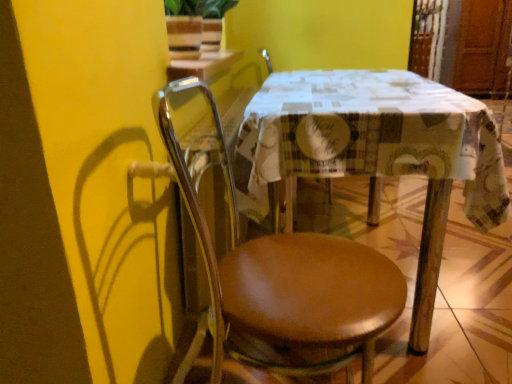
In the scene shown: What is the approximate height of brown leather chair at center?

It is 33.41 inches.

The image size is (512, 384). What do you see at coordinates (283, 277) in the screenshot?
I see `brown leather chair at center` at bounding box center [283, 277].

Where is `brown leather chair at center`? The image size is (512, 384). brown leather chair at center is located at coordinates (283, 277).

At what (x,y) coordinates should I click in order to perform the action: click on printed fabric table at center. Please return your answer as a coordinate pair (x, y). The height and width of the screenshot is (384, 512). Looking at the image, I should click on (376, 151).

Measure the distance between point (x=497, y=134) and camera.

The distance of point (x=497, y=134) from camera is 3.42 feet.

In order to face printed fabric table at center, should I rotate leftwards or rightwards?

It's best to rotate right around 11.702 degrees.

The width and height of the screenshot is (512, 384). Describe the element at coordinates (376, 151) in the screenshot. I see `printed fabric table at center` at that location.

What are the coordinates of `brown leather chair at center` in the screenshot? It's located at [x=283, y=277].

Is brown leather chair at center to the right of printed fabric table at center from the viewer's perspective?

No, brown leather chair at center is not to the right of printed fabric table at center.

Relative to printed fabric table at center, is brown leather chair at center in front or behind?

Visually, brown leather chair at center is located in front of printed fabric table at center.

Does point (220, 270) come closer to viewer compared to point (429, 172)?

Yes, it is.

From the image's perspective, is brown leather chair at center below printed fabric table at center?

Indeed, from the image's perspective, brown leather chair at center is shown beneath printed fabric table at center.

From a real-world perspective, between brown leather chair at center and printed fabric table at center, who is vertically lower?

printed fabric table at center.

Which of these two, brown leather chair at center or printed fabric table at center, is thinner?

With smaller width is brown leather chair at center.

Can you confirm if brown leather chair at center is shorter than printed fabric table at center?

No.

Can you confirm if brown leather chair at center is bigger than printed fabric table at center?

Actually, brown leather chair at center might be smaller than printed fabric table at center.

Which is correct: brown leather chair at center is inside printed fabric table at center, or outside of it?

brown leather chair at center lies outside printed fabric table at center.

Is brown leather chair at center with printed fabric table at center?

No.

From the picture: Is brown leather chair at center turned away from printed fabric table at center?

No, brown leather chair at center is not facing away from printed fabric table at center.

How many degrees apart are the facing directions of brown leather chair at center and printed fabric table at center?

0.000523 degrees separate the facing orientations of brown leather chair at center and printed fabric table at center.

In order to click on table located behind the brown leather chair at center in this screenshot , I will do `click(376, 151)`.

Considering the positions of objects printed fabric table at center and brown leather chair at center in the image provided, who is more to the left, printed fabric table at center or brown leather chair at center?

From the viewer's perspective, brown leather chair at center appears more on the left side.

Considering the relative positions of printed fabric table at center and brown leather chair at center in the image provided, is printed fabric table at center behind brown leather chair at center?

Yes.

Is point (502, 219) less distant than point (279, 351)?

Yes, it is.

From the image's perspective, which one is positioned higher, printed fabric table at center or brown leather chair at center?

printed fabric table at center, from the image's perspective.

From a real-world perspective, is printed fabric table at center below brown leather chair at center?

Yes, from a real-world perspective, printed fabric table at center is below brown leather chair at center.

Can you confirm if printed fabric table at center is thinner than brown leather chair at center?

No.

Based on the photo, is printed fabric table at center shorter than brown leather chair at center?

Correct, printed fabric table at center is not as tall as brown leather chair at center.

Considering the sizes of objects printed fabric table at center and brown leather chair at center in the image provided, who is smaller, printed fabric table at center or brown leather chair at center?

brown leather chair at center is smaller.

Is brown leather chair at center located within printed fabric table at center?

No, brown leather chair at center is located outside of printed fabric table at center.

Is printed fabric table at center directly adjacent to brown leather chair at center?

They are not placed beside each other.

Is brown leather chair at center at the back of printed fabric table at center?

No, printed fabric table at center's orientation is not away from brown leather chair at center.

Locate an element on the screen. chair on the left of the printed fabric table at center is located at coordinates tap(283, 277).

Find the location of a particular element. Image resolution: width=512 pixels, height=384 pixels. chair located in front of the printed fabric table at center is located at coordinates (283, 277).

Identify the location of table behind the brown leather chair at center. (376, 151).